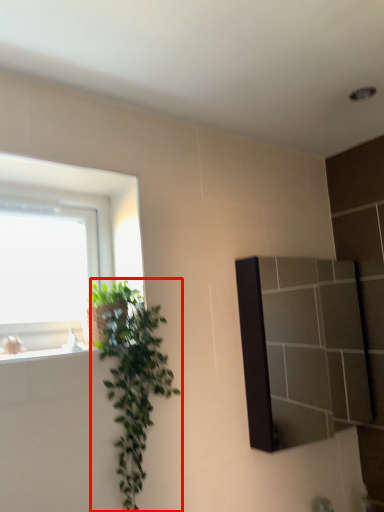
Question: From the image's perspective, what is the correct spatial relationship of houseplant (annotated by the red box) in relation to mirror?

Choices:
 (A) above
 (B) below

Answer: (B)